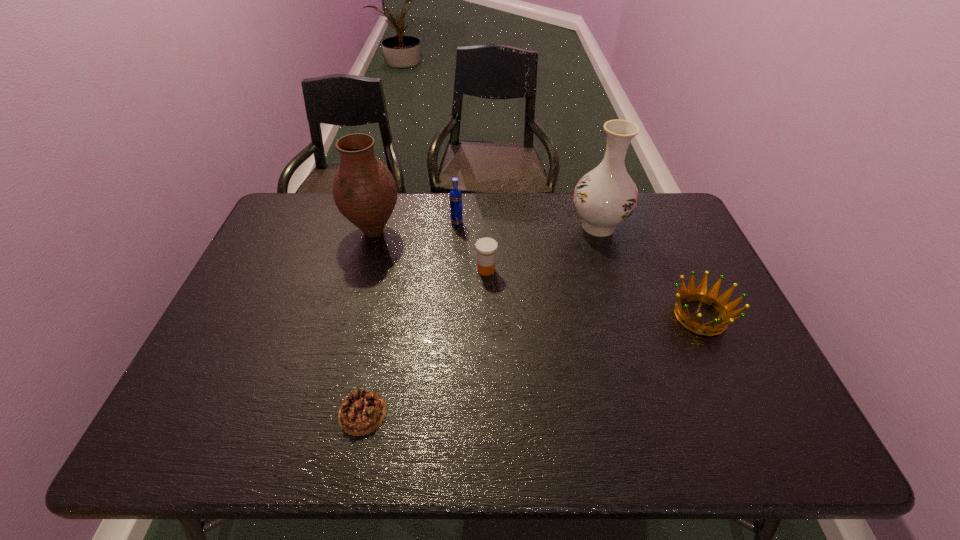
Where is `vacant region at the near edge of the desktop`? This screenshot has height=540, width=960. vacant region at the near edge of the desktop is located at coordinates (589, 417).

At what (x,y) coordinates should I click in order to perform the action: click on vacant point at the left edge. Please return your answer as a coordinate pair (x, y). The image size is (960, 540). Looking at the image, I should click on (285, 290).

What are the coordinates of `free space at the right edge of the desktop` in the screenshot? It's located at (677, 256).

Locate an element on the screen. The image size is (960, 540). free space at the far left corner is located at coordinates (310, 193).

The height and width of the screenshot is (540, 960). What are the coordinates of `vacant space at the far right corner of the desktop` in the screenshot? It's located at (655, 196).

Where is `free space between the third object from right to left and the left vase`? The width and height of the screenshot is (960, 540). free space between the third object from right to left and the left vase is located at coordinates (430, 251).

At what (x,y) coordinates should I click in order to perform the action: click on free space between the right vase and the vodka. Please return your answer as a coordinate pair (x, y). Image resolution: width=960 pixels, height=540 pixels. Looking at the image, I should click on (528, 225).

At what (x,y) coordinates should I click in order to perform the action: click on free space between the fourth farthest object and the third object from left to right. Please return your answer as a coordinate pair (x, y). The height and width of the screenshot is (540, 960). Looking at the image, I should click on (471, 246).

The height and width of the screenshot is (540, 960). What are the coordinates of `free spot between the second nearest object and the vodka` in the screenshot? It's located at (579, 269).

You are a GUI agent. You are given a task and a screenshot of the screen. Output one action in this format:
    pyautogui.click(x=<x>, y=<y>)
    Task: Click on the free spot between the left vase and the chocolate cake
    The width and height of the screenshot is (960, 540).
    Given the screenshot: What is the action you would take?
    pyautogui.click(x=369, y=322)